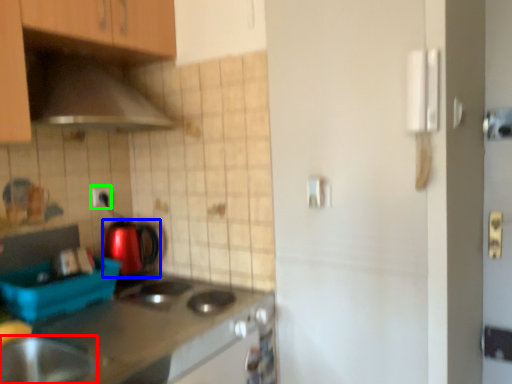
Question: Based on their relative distances, which object is nearer to home appliance (highlighted by a red box)? Choose from kitchen appliance (highlighted by a blue box) and electric outlet (highlighted by a green box).

Choices:
 (A) kitchen appliance
 (B) electric outlet

Answer: (A)